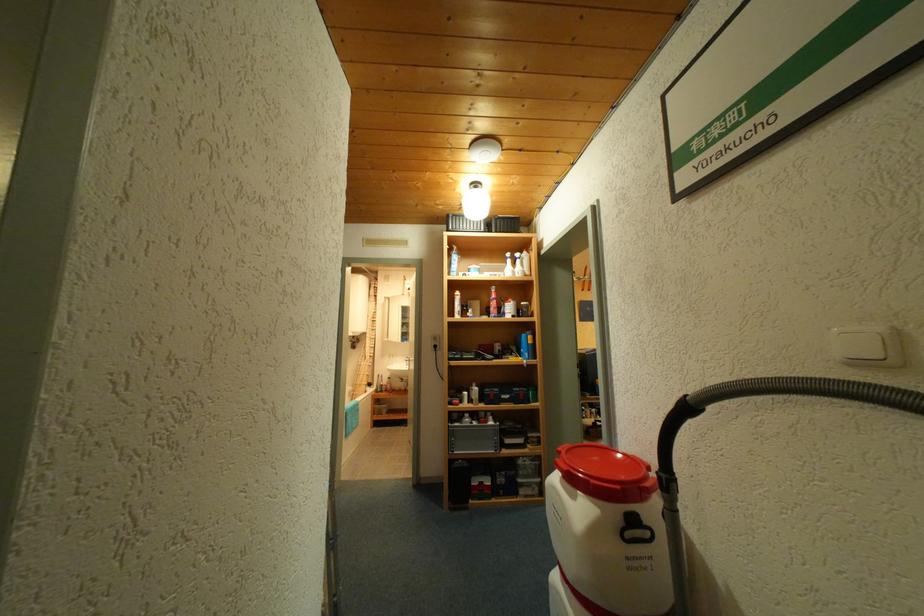
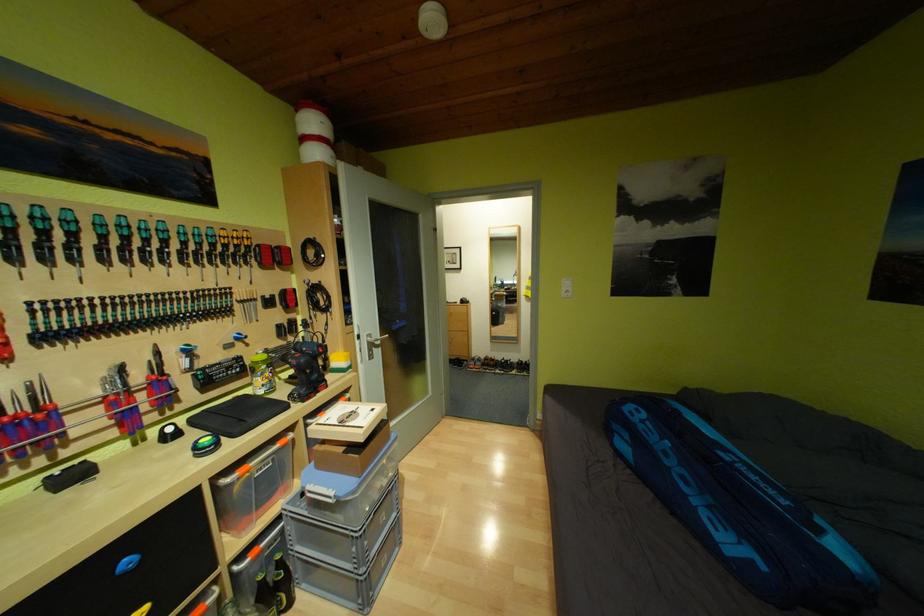
Question: I am providing you with two images of the same scene from different viewpoints. After the viewpoint changes to image2, which objects are now occluded?

Choices:
 (A) purple flower pot
 (B) white spray bottle
 (C) green screwdriver handle
 (D) red pliers handle

Answer: (B)